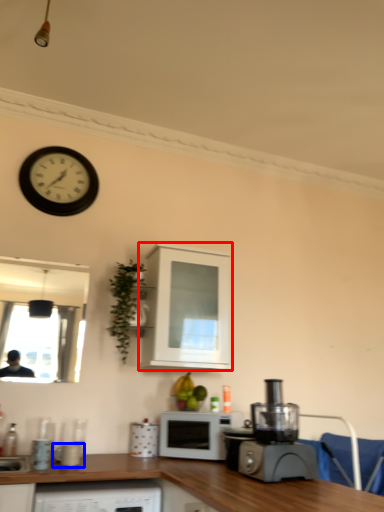
Question: Which object appears farthest to the camera in this image, cabinetry (highlighted by a red box) or appliance (highlighted by a blue box)?

Choices:
 (A) cabinetry
 (B) appliance

Answer: (A)